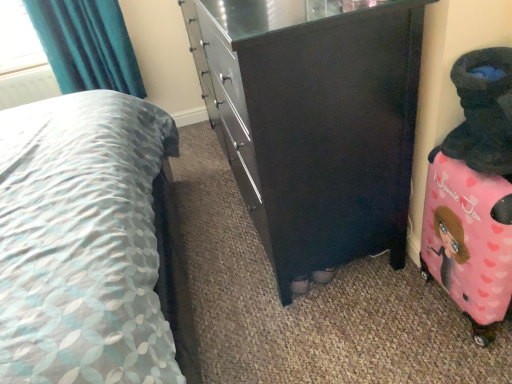
Question: Does point tap(354, 220) appear closer or farther from the camera than point tap(47, 344)?

Choices:
 (A) farther
 (B) closer

Answer: (A)

Question: From the image's perspective, relative to patterned fabric bed at center, is matte black dresser at center above or below?

Choices:
 (A) below
 (B) above

Answer: (B)

Question: Estimate the real-world distances between objects in this image. Which object is farther from the pink fabric suitcase at right?

Choices:
 (A) teal fabric curtain at upper left
 (B) patterned fabric bed at center
 (C) matte black dresser at center
 (D) white plastic radiator at upper left

Answer: (D)

Question: Which of these objects is positioned closest to the pink fabric suitcase at right?

Choices:
 (A) matte black dresser at center
 (B) patterned fabric bed at center
 (C) white plastic radiator at upper left
 (D) teal fabric curtain at upper left

Answer: (A)